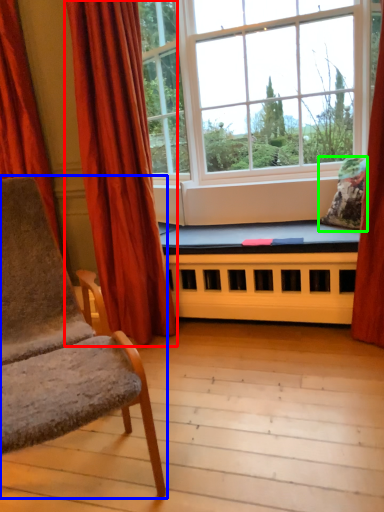
Question: Based on their relative distances, which object is farther from curtain (highlighted by a red box)? Choose from chair (highlighted by a blue box) and pillow (highlighted by a green box).

Choices:
 (A) chair
 (B) pillow

Answer: (B)